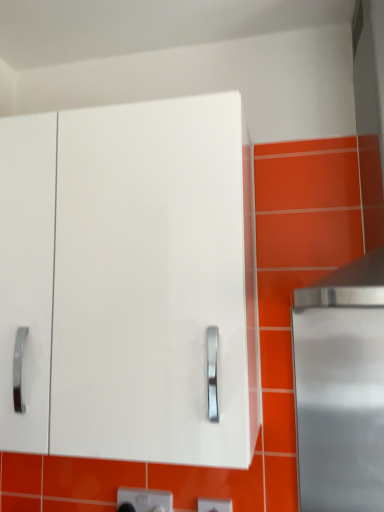
Question: In which direction should I rotate to look at white plastic electric outlet at lower center, which is the second electric outlet in left-to-right order?

Choices:
 (A) left
 (B) right

Answer: (B)

Question: Does white glossy cabinet at center have a lesser height compared to white plastic electric outlet at lower center, which is counted as the 1th electric outlet, starting from the left?

Choices:
 (A) no
 (B) yes

Answer: (A)

Question: Does white glossy cabinet at center have a lesser width compared to white plastic electric outlet at lower center, positioned as the 2th electric outlet in right-to-left order?

Choices:
 (A) yes
 (B) no

Answer: (B)

Question: Is white glossy cabinet at center completely or partially outside of white plastic electric outlet at lower center, positioned as the 2th electric outlet in right-to-left order?

Choices:
 (A) no
 (B) yes

Answer: (B)

Question: Could you tell me if white glossy cabinet at center is facing white plastic electric outlet at lower center, positioned as the 2th electric outlet in right-to-left order?

Choices:
 (A) no
 (B) yes

Answer: (A)

Question: From a real-world perspective, is white glossy cabinet at center positioned over white plastic electric outlet at lower center, which is counted as the 1th electric outlet, starting from the left, based on gravity?

Choices:
 (A) no
 (B) yes

Answer: (B)

Question: Is white plastic electric outlet at lower center, which appears as the 1th electric outlet when viewed from the back, completely or partially inside white glossy cabinet at center?

Choices:
 (A) no
 (B) yes

Answer: (A)

Question: Is white glossy cabinet at center at the right side of white plastic electric outlet at lower center, which is the second electric outlet in left-to-right order?

Choices:
 (A) no
 (B) yes

Answer: (A)

Question: From the image's perspective, is white glossy cabinet at center located above white plastic electric outlet at lower center, which is counted as the first electric outlet, starting from the right?

Choices:
 (A) no
 (B) yes

Answer: (B)

Question: Is white glossy cabinet at center in front of white plastic electric outlet at lower center, which is the second electric outlet in left-to-right order?

Choices:
 (A) yes
 (B) no

Answer: (A)

Question: From a real-world perspective, is white glossy cabinet at center over white plastic electric outlet at lower center, which is counted as the first electric outlet, starting from the front?

Choices:
 (A) no
 (B) yes

Answer: (B)

Question: Considering the relative sizes of white glossy cabinet at center and white plastic electric outlet at lower center, which is counted as the first electric outlet, starting from the right, in the image provided, is white glossy cabinet at center taller than white plastic electric outlet at lower center, which is counted as the first electric outlet, starting from the right,?

Choices:
 (A) no
 (B) yes

Answer: (B)

Question: Is white glossy cabinet at center outside of white plastic electric outlet at lower center, which is counted as the first electric outlet, starting from the front?

Choices:
 (A) no
 (B) yes

Answer: (B)

Question: Is white plastic electric outlet at lower center, which is counted as the first electric outlet, starting from the front, positioned behind white plastic electric outlet at lower center, which is counted as the 1th electric outlet, starting from the left?

Choices:
 (A) yes
 (B) no

Answer: (B)